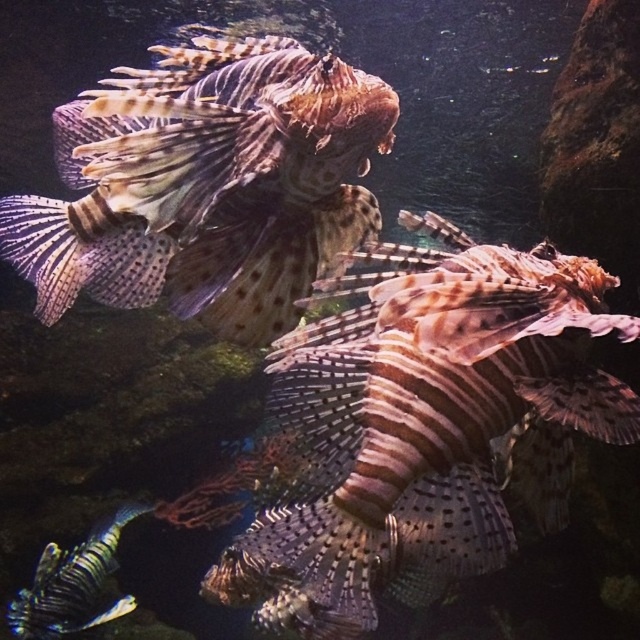
Which is in front, point (365, 125) or point (83, 573)?

Positioned in front is point (365, 125).

Is brown textured lionfish at center to the right of shiny blue fish at bottom left from the viewer's perspective?

Correct, you'll find brown textured lionfish at center to the right of shiny blue fish at bottom left.

Image resolution: width=640 pixels, height=640 pixels. What do you see at coordinates (208, 186) in the screenshot?
I see `brown textured lionfish at center` at bounding box center [208, 186].

Find the location of a particular element. brown textured lionfish at center is located at coordinates (208, 186).

Can you confirm if speckled brown fish at center is bigger than brown textured lionfish at center?

Correct, speckled brown fish at center is larger in size than brown textured lionfish at center.

Which is behind, point (388, 522) or point (333, 138)?

Positioned behind is point (388, 522).

Does point (305, 621) lie in front of point (285, 74)?

No, (305, 621) is behind (285, 74).

Locate an element on the screen. This screenshot has height=640, width=640. speckled brown fish at center is located at coordinates (426, 426).

Who is higher up, speckled brown fish at center or shiny blue fish at bottom left?

Positioned higher is speckled brown fish at center.

Can you confirm if speckled brown fish at center is positioned above shiny blue fish at bottom left?

Indeed, speckled brown fish at center is positioned over shiny blue fish at bottom left.

Identify the location of speckled brown fish at center. Image resolution: width=640 pixels, height=640 pixels. (x=426, y=426).